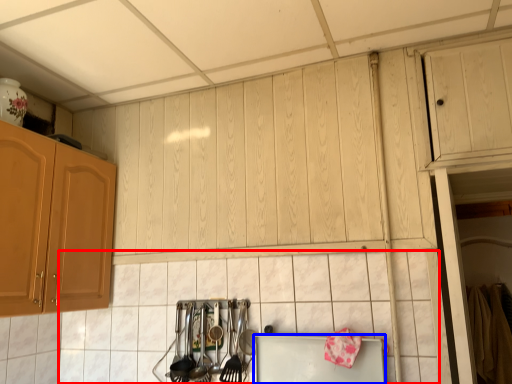
Question: Which object appears closest to the camera in this image, tile (highlighted by a red box) or appliance (highlighted by a blue box)?

Choices:
 (A) tile
 (B) appliance

Answer: (A)